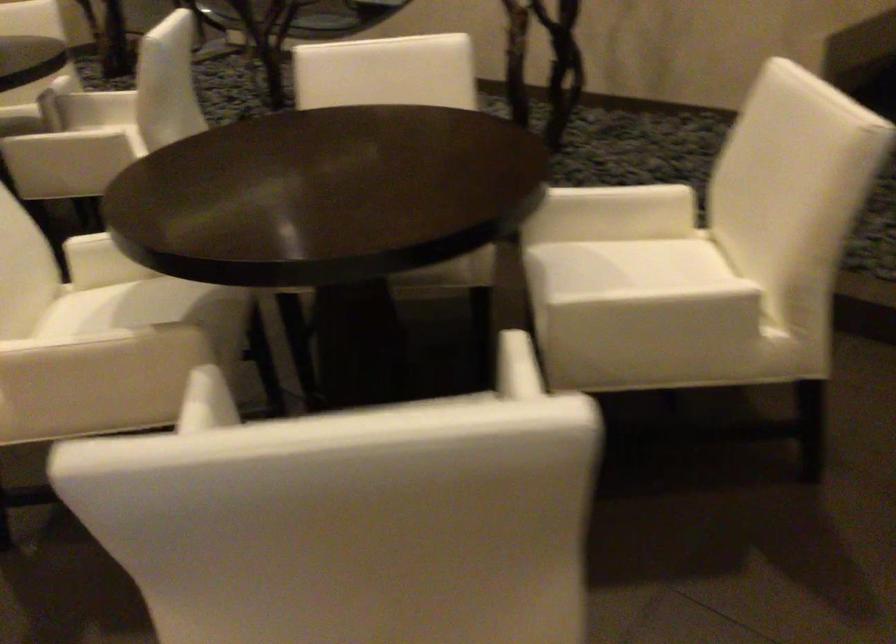
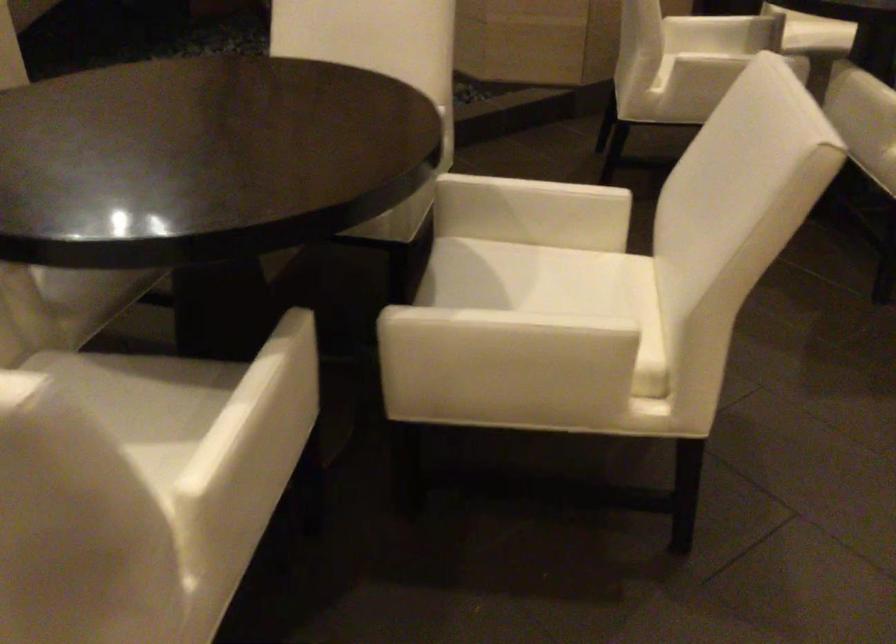
Find the pixel in the second image that matches point (153, 392) in the first image.

(299, 413)